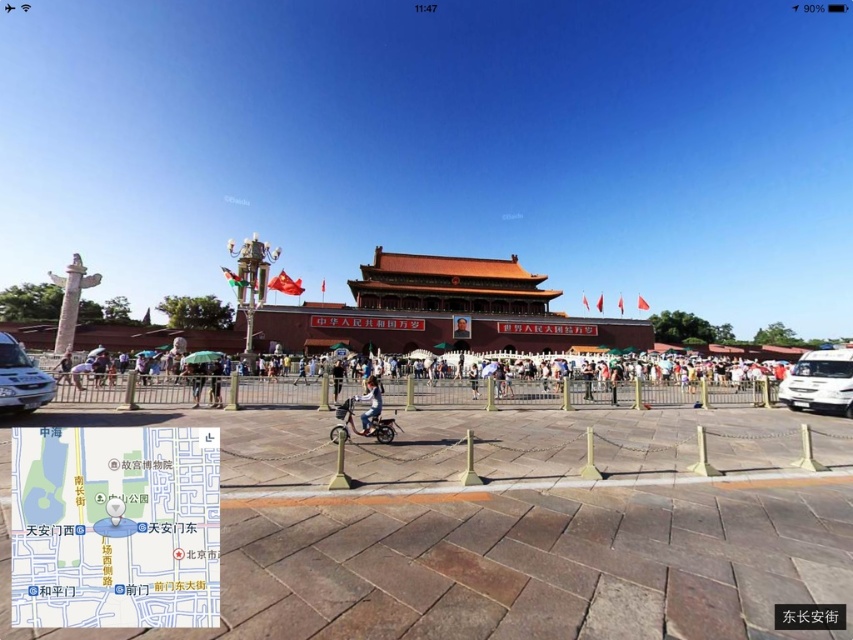
You are a photographer planning to capture the entire scene of the traditional Chinese building with its red facade and golden roof. You notice a white glossy van at lower left and a light blue denim jacket at center in your frame. Since you want to focus on the building, which object should you avoid blocking the building view and why?

You should avoid blocking the white glossy van at lower left because it is bigger than the light blue denim jacket at center and might obstruct the view of the building more significantly.

You are a tourist in the public square and want to find the nearest restroom. You see the brown wooden map at lower left and the matte red building at center. According to the map, the restroom is located behind the building. Which object should you approach first to reach the restroom?

The restroom is located behind the matte red building at center. To reach it, you should first approach the brown wooden map at lower left to check the directions, since it is thinner and easier to navigate around compared to the larger matte red building at center.